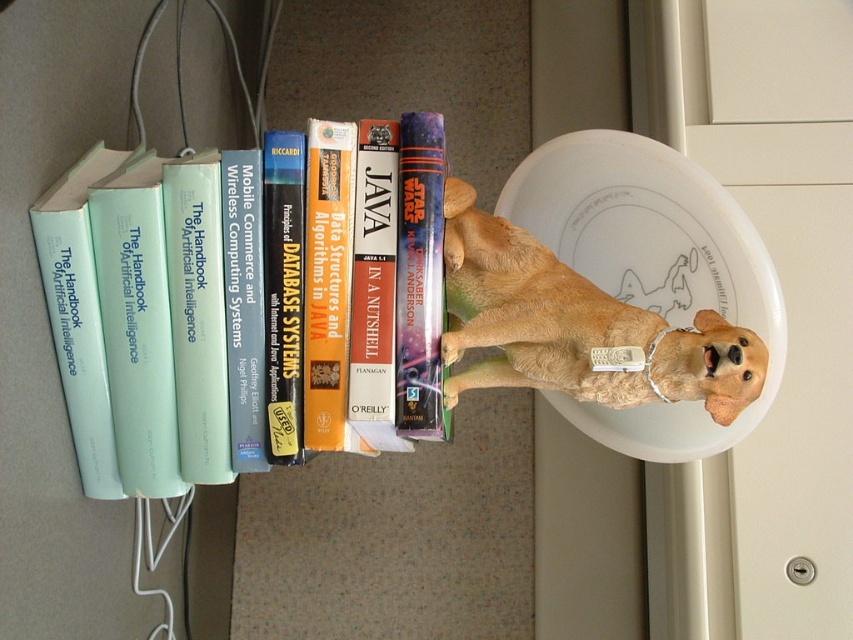
Is light blue paperback book at left taller than hardcover book at center?

Yes, light blue paperback book at left is taller than hardcover book at center.

Does point (154, 324) come behind point (413, 262)?

Yes, point (154, 324) is farther from viewer.

Where is `light blue paperback book at left`? light blue paperback book at left is located at coordinates (154, 317).

Which is above, light blue paperback book at left or golden fur dog at center?

Positioned higher is light blue paperback book at left.

Is light blue paperback book at left positioned in front of golden fur dog at center?

No, it is not.

What do you see at coordinates (154, 317) in the screenshot? I see `light blue paperback book at left` at bounding box center [154, 317].

At what (x,y) coordinates should I click in order to perform the action: click on light blue paperback book at left. Please return your answer as a coordinate pair (x, y). Looking at the image, I should click on (154, 317).

Which is more to the left, golden fur dog at center or hardcover book at center?

Positioned to the left is hardcover book at center.

Between point (444, 353) and point (410, 164), which one is positioned in front?

Point (410, 164)

Does point (622, 339) lie in front of point (433, 307)?

Yes, point (622, 339) is closer to viewer.

Locate an element on the screen. golden fur dog at center is located at coordinates (576, 326).